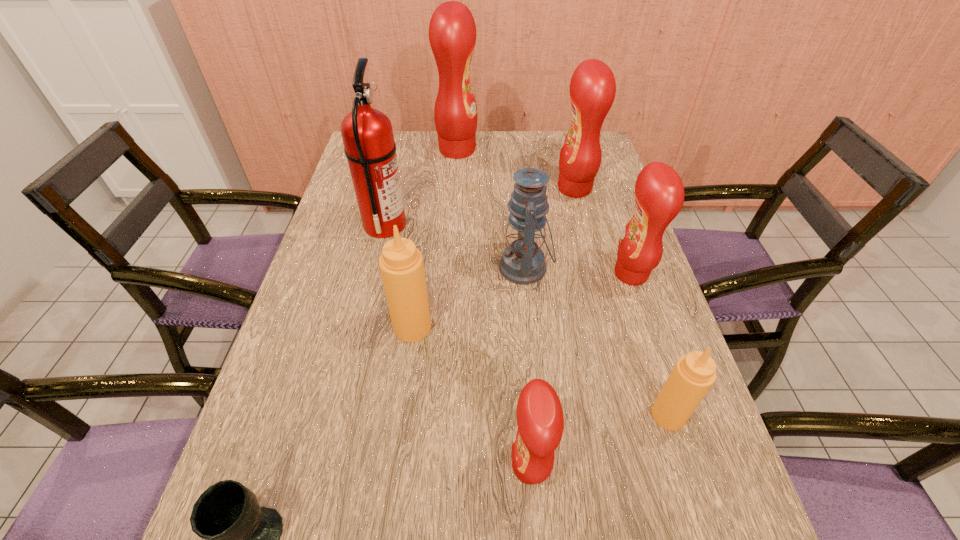
Image resolution: width=960 pixels, height=540 pixels. In order to click on vacant space located on the label side of the third farthest condiment in this screenshot , I will do `click(499, 274)`.

The image size is (960, 540). Find the location of `vacant space located 0.280m on the label side of the third farthest condiment`. vacant space located 0.280m on the label side of the third farthest condiment is located at coordinates (504, 274).

Locate an element on the screen. vacant space situated 0.180m on the label side of the third farthest condiment is located at coordinates (542, 274).

Where is `vacant area situated 0.050m on the front-facing side of the lantern`? This screenshot has width=960, height=540. vacant area situated 0.050m on the front-facing side of the lantern is located at coordinates (480, 268).

This screenshot has width=960, height=540. I want to click on vacant space located 0.140m on the front-facing side of the lantern, so click(x=445, y=268).

You are a GUI agent. You are given a task and a screenshot of the screen. Output one action in this format:
    pyautogui.click(x=<x>, y=<y>)
    Task: Click on the vacant area situated on the front-facing side of the lantern
    
    Given the screenshot: What is the action you would take?
    pyautogui.click(x=426, y=268)

You are a GUI agent. You are given a task and a screenshot of the screen. Output one action in this format:
    pyautogui.click(x=<x>, y=<y>)
    Task: Click on the vacant space located 0.080m on the front of the fifth farthest condiment
    
    Given the screenshot: What is the action you would take?
    pyautogui.click(x=687, y=474)

You are a GUI agent. You are given a task and a screenshot of the screen. Output one action in this format:
    pyautogui.click(x=<x>, y=<y>)
    Task: Click on the free space located on the label side of the nearest red condiment
    
    Given the screenshot: What is the action you would take?
    pyautogui.click(x=322, y=467)

I want to click on vacant space located 0.290m on the label side of the nearest red condiment, so click(349, 467).

I want to click on vacant space located 0.140m on the label side of the nearest red condiment, so click(x=432, y=467).